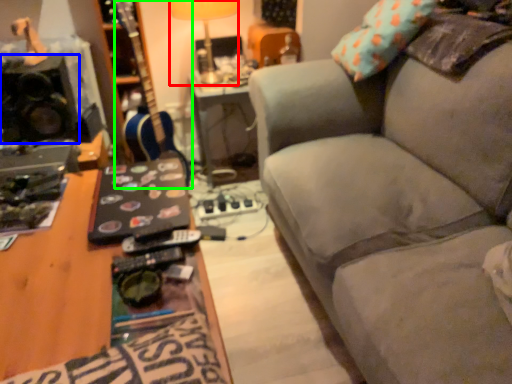
Question: Which object is the closest to the lamp (highlighted by a red box)? Choose among these: loudspeaker (highlighted by a blue box) or guitar (highlighted by a green box).

Choices:
 (A) loudspeaker
 (B) guitar

Answer: (B)